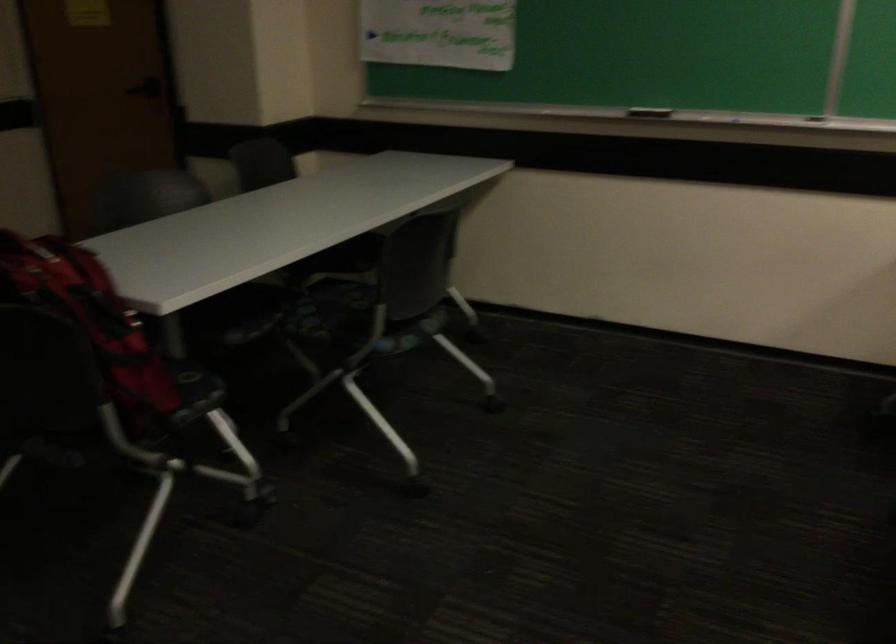
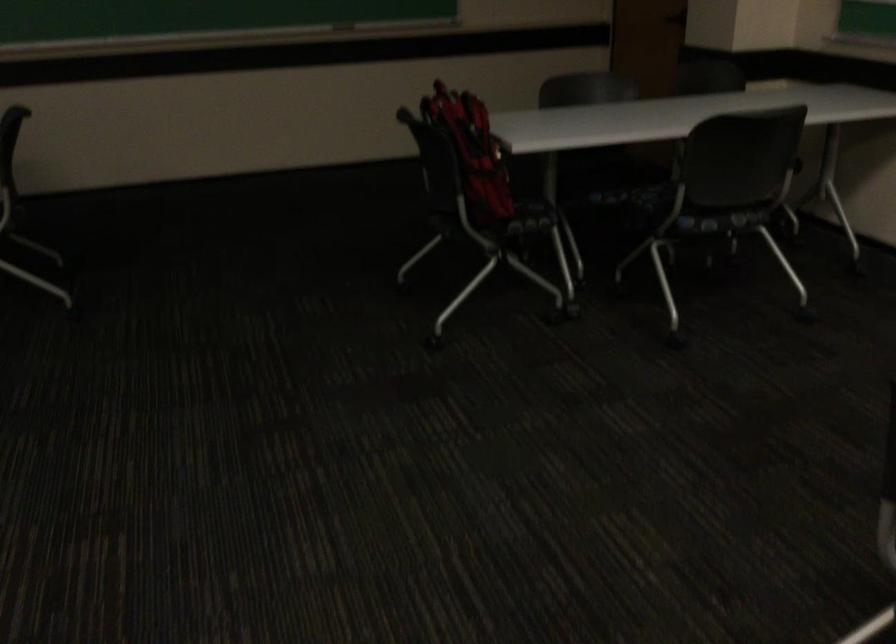
Find the pixel in the second image that matches pixel 102 330 in the first image.

(471, 152)